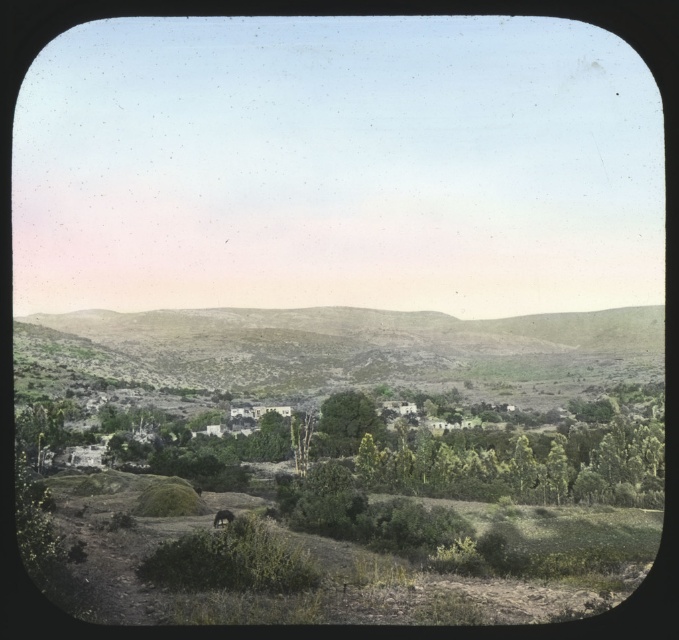
You are standing at the edge of the dirt path in this rural landscape. You notice both the green grassy hillside at center and the green leafy tree at center. Which one is positioned to the left of the other?

The green grassy hillside at center is to the left of the green leafy tree at center.

You are standing at the bottom of the green grassy hillside at center. Which direction should you walk to reach the top?

Since the green grassy hillside at center is located at point [356,348], you should walk towards the upper direction to reach the top.

You are standing on the dirt path in the foreground of the scene. You see a green leafy tree at center and a brown furry dog at lower center. Which object is closer to you?

The brown furry dog at lower center is closer to you because it is positioned at lower center, which is typically nearer in such scenes compared to the green leafy tree at center that might be further back.